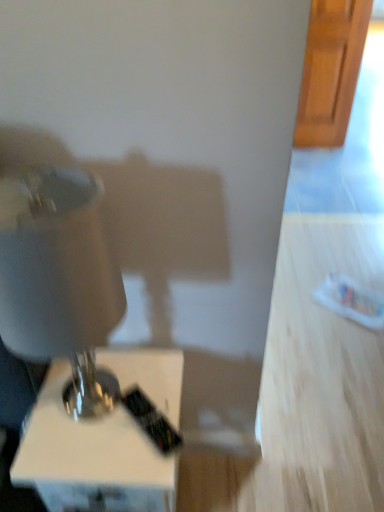
What do you see at coordinates (91, 458) in the screenshot? I see `white glossy lamp at lower left` at bounding box center [91, 458].

Locate an element on the screen. white glossy lamp at lower left is located at coordinates (91, 458).

What do you see at coordinates (76, 346) in the screenshot? This screenshot has height=512, width=384. I see `white glossy sewing machine at left` at bounding box center [76, 346].

You are a GUI agent. You are given a task and a screenshot of the screen. Output one action in this format:
    pyautogui.click(x=<x>, y=<y>)
    Task: Click on the white glossy sewing machine at left
    The image size is (384, 512).
    Given the screenshot: What is the action you would take?
    pyautogui.click(x=76, y=346)

Image resolution: width=384 pixels, height=512 pixels. Identify the location of white glossy lamp at lower left. (91, 458).

Considering the relative positions of white glossy lamp at lower left and white glossy sewing machine at left in the image provided, is white glossy lamp at lower left to the left of white glossy sewing machine at left from the viewer's perspective?

Incorrect, white glossy lamp at lower left is not on the left side of white glossy sewing machine at left.

Which object is closer to the camera, white glossy lamp at lower left or white glossy sewing machine at left?

white glossy sewing machine at left is closer to the camera.

Considering the positions of points (41, 446) and (163, 489), is point (41, 446) farther from camera compared to point (163, 489)?

No, (41, 446) is in front of (163, 489).

From the image's perspective, between white glossy lamp at lower left and white glossy sewing machine at left, who is located below?

white glossy lamp at lower left, from the image's perspective.

Based on the photo, from a real-world perspective, is white glossy lamp at lower left below white glossy sewing machine at left?

Yes, from a real-world perspective, white glossy lamp at lower left is beneath white glossy sewing machine at left.

Considering the sizes of objects white glossy lamp at lower left and white glossy sewing machine at left in the image provided, who is thinner, white glossy lamp at lower left or white glossy sewing machine at left?

white glossy sewing machine at left.

Is white glossy lamp at lower left taller than white glossy sewing machine at left?

Incorrect, the height of white glossy lamp at lower left is not larger of that of white glossy sewing machine at left.

Can you confirm if white glossy lamp at lower left is smaller than white glossy sewing machine at left?

No.

Choose the correct answer: Is white glossy lamp at lower left inside white glossy sewing machine at left or outside it?

white glossy lamp at lower left is spatially situated outside white glossy sewing machine at left.

Are white glossy lamp at lower left and white glossy sewing machine at left making contact?

Absolutely, white glossy lamp at lower left is next to and touching white glossy sewing machine at left.

Does white glossy lamp at lower left turn towards white glossy sewing machine at left?

No.

Identify the location of sewing machine above the white glossy lamp at lower left (from a real-world perspective). (76, 346).

Which is more to the left, white glossy sewing machine at left or white glossy lamp at lower left?

Positioned to the left is white glossy sewing machine at left.

Based on the photo, does white glossy sewing machine at left lie behind white glossy lamp at lower left?

No.

Is point (65, 220) more distant than point (101, 490)?

No, it is in front of (101, 490).

In the scene shown: From the image's perspective, is white glossy sewing machine at left above or below white glossy lamp at lower left?

white glossy sewing machine at left is situated higher than white glossy lamp at lower left in the image.

From a real-world perspective, who is located higher, white glossy sewing machine at left or white glossy lamp at lower left?

white glossy sewing machine at left.

Is white glossy sewing machine at left thinner than white glossy lamp at lower left?

Yes, white glossy sewing machine at left is thinner than white glossy lamp at lower left.

Consider the image. Is white glossy sewing machine at left taller or shorter than white glossy lamp at lower left?

In the image, white glossy sewing machine at left appears to be taller than white glossy lamp at lower left.

Who is smaller, white glossy sewing machine at left or white glossy lamp at lower left?

white glossy sewing machine at left.

Choose the correct answer: Is white glossy sewing machine at left inside white glossy lamp at lower left or outside it?

white glossy sewing machine at left is not enclosed by white glossy lamp at lower left.

Is white glossy sewing machine at left in contact with white glossy lamp at lower left?

Yes, white glossy sewing machine at left is in contact with white glossy lamp at lower left.

Is white glossy sewing machine at left turned away from white glossy lamp at lower left?

No, white glossy lamp at lower left is not at the back of white glossy sewing machine at left.

Consider the image. Can you tell me how much white glossy sewing machine at left and white glossy lamp at lower left differ in facing direction?

The facing directions of white glossy sewing machine at left and white glossy lamp at lower left are 7.62 degrees apart.

Find the location of a particular element. furniture below the white glossy sewing machine at left (from a real-world perspective) is located at coordinates (91, 458).

What are the coordinates of `furniture on the right of white glossy sewing machine at left` in the screenshot? It's located at (91, 458).

This screenshot has height=512, width=384. In order to click on furniture below the white glossy sewing machine at left (from a real-world perspective) in this screenshot , I will do `click(91, 458)`.